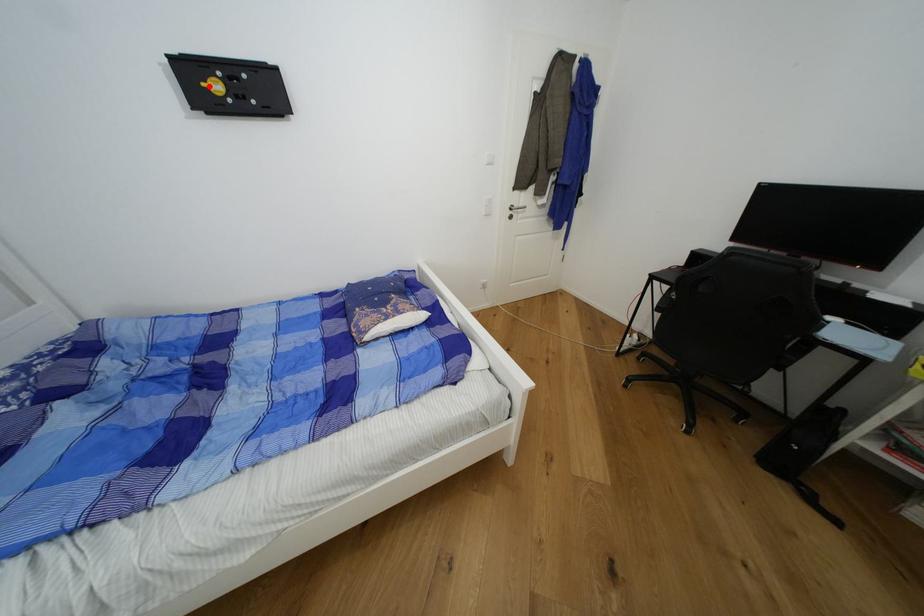
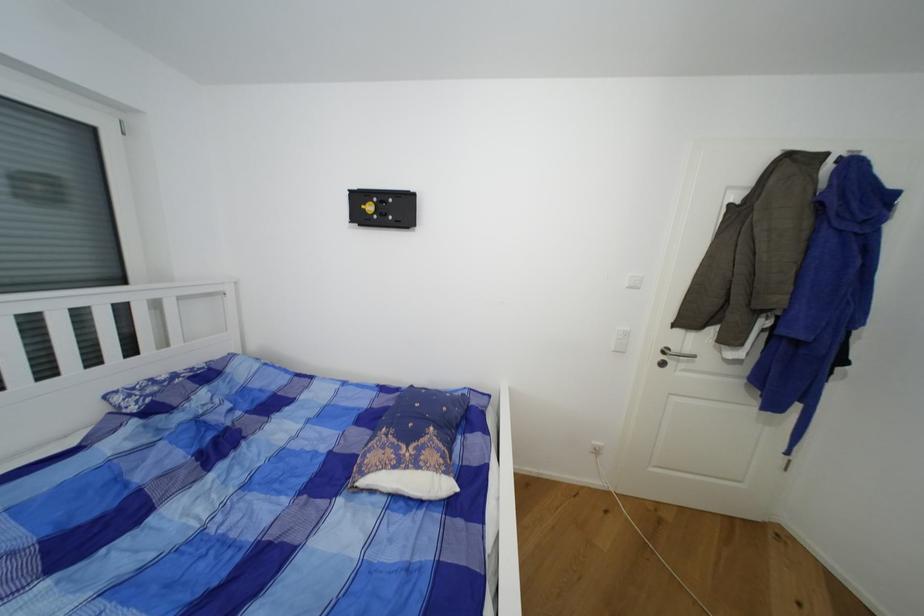
Where in the second image is the point corresponding to the highlighted location from the first image?

(369, 208)